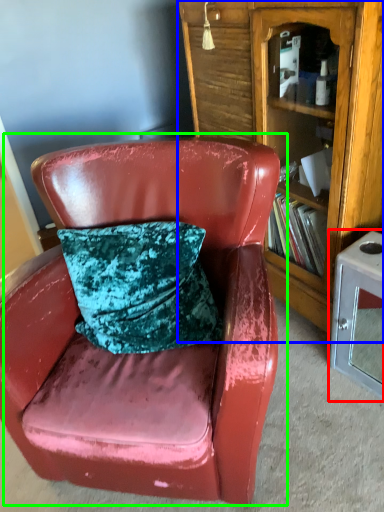
Question: Based on their relative distances, which object is farther from table (highlighted by a red box)? Choose from bookcase (highlighted by a blue box) and chair (highlighted by a green box).

Choices:
 (A) bookcase
 (B) chair

Answer: (B)